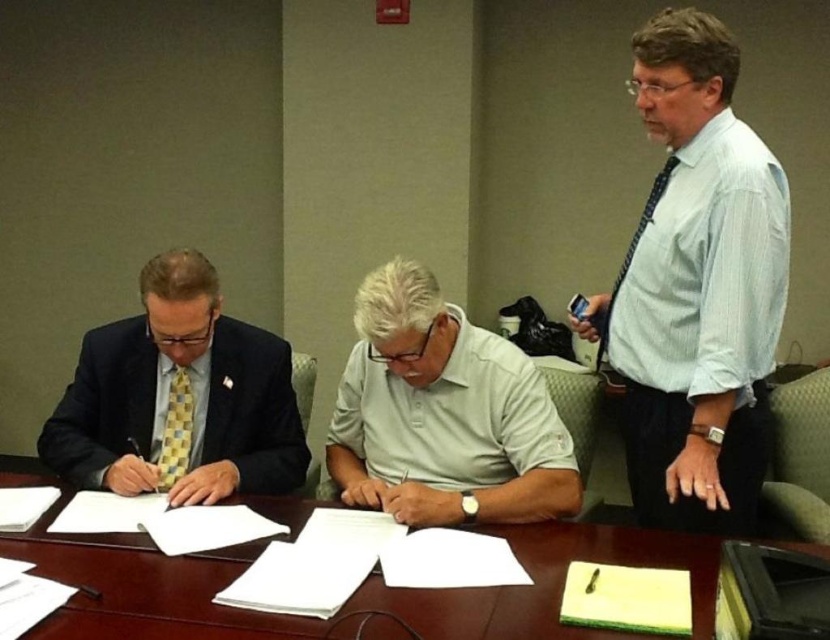
You are standing at the table and want to reach the green notebook with a pen resting on top located at point (640, 448). If your arm can extend 1.8 meters, can you reach it?

The distance of point (640, 448) from camera is 1.92 meters, so no, you cannot reach the green notebook with a pen resting on top located at point (640, 448) since it is further away than your arm can extend.

You are organizing a signing ceremony and need to place a 1.5 meter long document on the table. Given the brown wooden table at center and the blue dotted tie at right, can the document fit on the table?

The brown wooden table at center is larger in size than the blue dotted tie at right. Since the blue dotted tie at right is likely smaller than the table, the 1.5 meter document may fit, but the exact dimensions of the table are unknown. However, based on the description, the table is large enough to accommodate the document.

You are an event planner observing the signing ceremony. You need to ensure that the white striped shirt at right and the checkered fabric tie at left are visible in the group photo. Since the camera is positioned at the back of the room, which object might be partially hidden if they are closer to the camera? Explain using their sizes.

The checkered fabric tie at left is smaller in size compared to the white striped shirt at right. Since the camera is at the back, the larger white striped shirt at right might block the smaller checkered fabric tie at left in the photo, making it partially hidden.